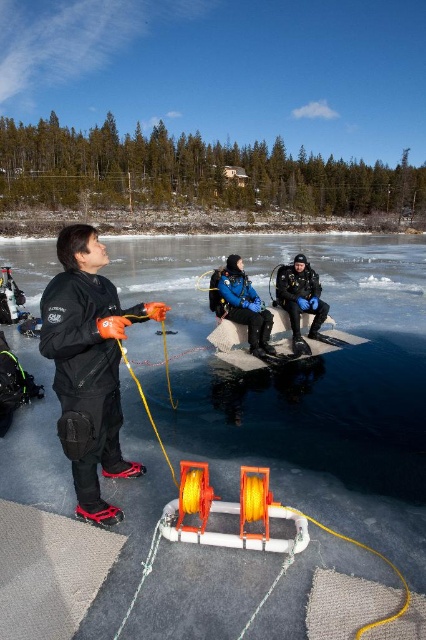
Question: Does transparent ice at center have a smaller size compared to blue diving suit at center?

Choices:
 (A) no
 (B) yes

Answer: (A)

Question: Which of these objects is positioned farthest from the black matte wetsuit at left?

Choices:
 (A) transparent ice at center
 (B) blue diving suit at center
 (C) blue matte diving suit at center

Answer: (A)

Question: Does transparent ice at center appear on the right side of blue matte diving suit at center?

Choices:
 (A) no
 (B) yes

Answer: (B)

Question: Which point is farther to the camera?

Choices:
 (A) black matte wetsuit at left
 (B) transparent ice at center

Answer: (B)

Question: Which point appears farthest from the camera in this image?

Choices:
 (A) pos(293,320)
 (B) pos(86,324)
 (C) pos(259,449)
 (D) pos(242,324)

Answer: (A)

Question: Is transparent ice at center to the right of blue matte diving suit at center from the viewer's perspective?

Choices:
 (A) yes
 (B) no

Answer: (A)